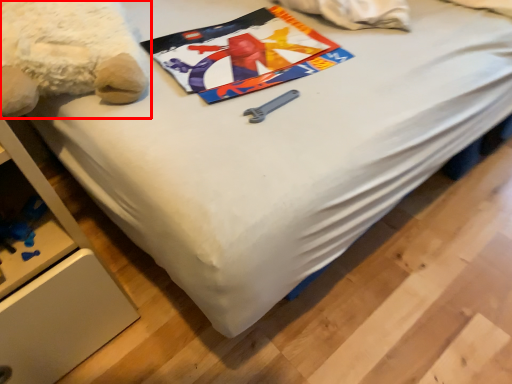
Question: In this image, where is teddy bear (annotated by the red box) located relative to design?

Choices:
 (A) right
 (B) left

Answer: (B)